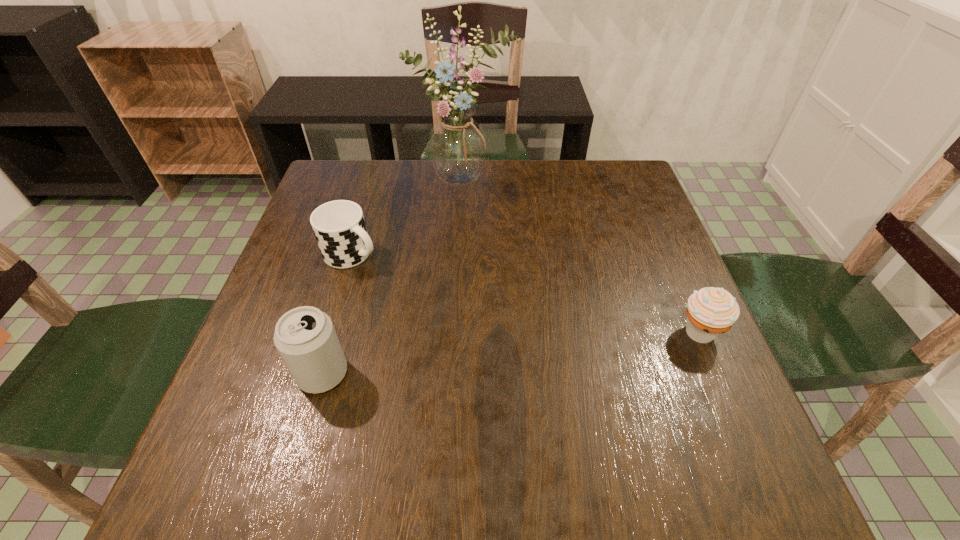
Identify the location of the second tallest object. Image resolution: width=960 pixels, height=540 pixels. (305, 337).

Identify the location of can. The width and height of the screenshot is (960, 540). (305, 337).

Where is `the rightmost object`? the rightmost object is located at coordinates (711, 311).

Locate an element on the screen. This screenshot has width=960, height=540. the third farthest object is located at coordinates (711, 311).

Locate an element on the screen. This screenshot has height=540, width=960. the third nearest object is located at coordinates tap(339, 227).

Where is `the farthest object`? the farthest object is located at coordinates (457, 145).

Identify the location of the third object from left to right. This screenshot has height=540, width=960. (457, 145).

Where is `vacant space positioned 0.060m on the back of the can`? The image size is (960, 540). vacant space positioned 0.060m on the back of the can is located at coordinates (336, 328).

At what (x,y) coordinates should I click in order to perform the action: click on vacant space located on the left of the rightmost object. Please return your answer as a coordinate pair (x, y). Image resolution: width=960 pixels, height=540 pixels. Looking at the image, I should click on (514, 332).

Identify the location of vacant space located on the side of the second farthest object with the handle. (419, 288).